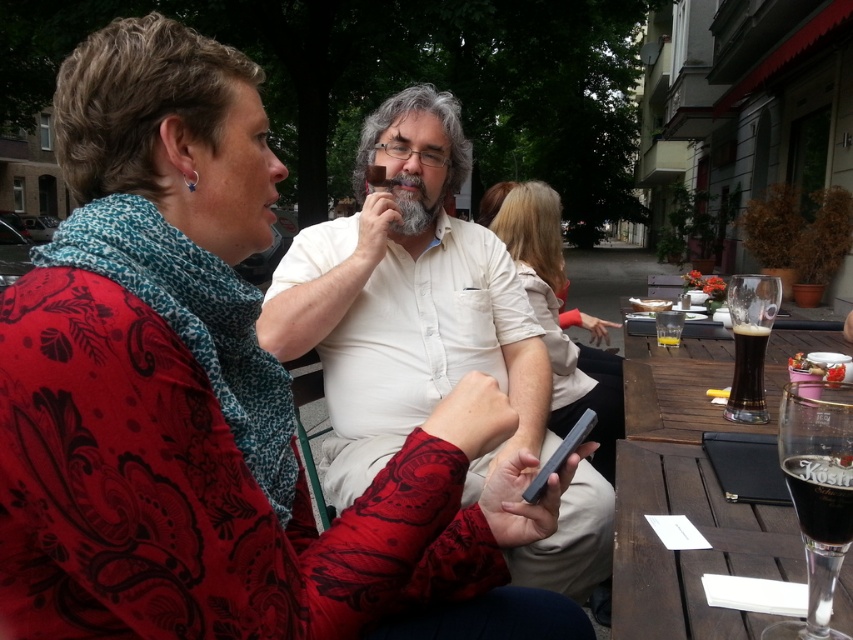
Who is lower down, clear glass beer at table right or dark brown glass at right?

clear glass beer at table right is below.

Where is `clear glass beer at table right`? The height and width of the screenshot is (640, 853). clear glass beer at table right is located at coordinates point(817,493).

Which of these two, dark brown glass at right or dark glass beer at table right, stands taller?

Standing taller between the two is dark brown glass at right.

Does dark brown glass at right come behind dark glass beer at table right?

No, it is not.

Who is more distant from viewer, (x=753, y=371) or (x=751, y=364)?

Positioned behind is point (x=753, y=371).

Find the location of a particular element. The image size is (853, 640). dark brown glass at right is located at coordinates (750, 342).

Does dark wood table at lower right have a greater height compared to clear glass beer at table right?

No, dark wood table at lower right is not taller than clear glass beer at table right.

Can you confirm if dark wood table at lower right is smaller than clear glass beer at table right?

Actually, dark wood table at lower right might be larger than clear glass beer at table right.

Is point (709, 497) less distant than point (830, 483)?

No, it is not.

Where is `dark wood table at lower right`? Image resolution: width=853 pixels, height=640 pixels. dark wood table at lower right is located at coordinates (689, 548).